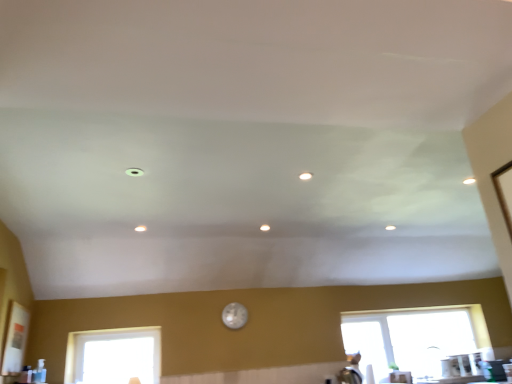
Identify the location of transparent glass window at lower right, which is the second window from front to back. The height and width of the screenshot is (384, 512). click(x=414, y=338).

Describe the element at coordinates (114, 356) in the screenshot. I see `transparent glass window at lower left, the second window in the right-to-left sequence` at that location.

I want to click on transparent glass window at lower right, the 2th window when ordered from left to right, so point(414,338).

Between transparent glass window at lower left, the second window in the right-to-left sequence, and transparent glass window at lower right, which is the second window from front to back, which one has smaller size?

transparent glass window at lower left, the second window in the right-to-left sequence, is smaller.

From a real-world perspective, is transparent glass window at lower left, the second window in the right-to-left sequence, located beneath transparent glass window at lower right, which is the second window from front to back?

Actually, transparent glass window at lower left, the second window in the right-to-left sequence, is physically above transparent glass window at lower right, which is the second window from front to back, in the real world.

At what (x,y) coordinates should I click in order to perform the action: click on window on the left of transparent glass window at lower right, the 2th window when ordered from left to right. Please return your answer as a coordinate pair (x, y). This screenshot has width=512, height=384. Looking at the image, I should click on (114, 356).

Is the position of transparent glass window at lower left, the second window in the right-to-left sequence, less distant than that of transparent glass window at lower right, the 2th window when ordered from left to right?

Yes, transparent glass window at lower left, the second window in the right-to-left sequence, is closer to the viewer.

Who is bigger, transparent glass window at lower left, which is the 2th window from back to front, or pearl-like glass clock at center?

transparent glass window at lower left, which is the 2th window from back to front, is bigger.

From the image's perspective, is transparent glass window at lower left, the second window in the right-to-left sequence, above or below pearl-like glass clock at center?

transparent glass window at lower left, the second window in the right-to-left sequence, is situated lower than pearl-like glass clock at center in the image.

This screenshot has width=512, height=384. What are the coordinates of `clock on the right of transparent glass window at lower left, the first window when ordered from front to back` in the screenshot? It's located at (234, 315).

From a real-world perspective, is transparent glass window at lower left, the second window in the right-to-left sequence, positioned above or below pearl-like glass clock at center?

From a real-world perspective, transparent glass window at lower left, the second window in the right-to-left sequence, is physically below pearl-like glass clock at center.

Considering the sizes of objects transparent glass window at lower right, the 2th window when ordered from left to right, and pearl-like glass clock at center in the image provided, who is bigger, transparent glass window at lower right, the 2th window when ordered from left to right, or pearl-like glass clock at center?

transparent glass window at lower right, the 2th window when ordered from left to right.

Considering the relative positions of transparent glass window at lower right, the 2th window when ordered from left to right, and pearl-like glass clock at center in the image provided, is transparent glass window at lower right, the 2th window when ordered from left to right, to the left or to the right of pearl-like glass clock at center?

transparent glass window at lower right, the 2th window when ordered from left to right, is positioned on pearl-like glass clock at center's right side.

Does point (454, 320) lie behind point (241, 305)?

Yes, it is behind point (241, 305).

Is pearl-like glass clock at center turned away from transparent glass window at lower right, the first window in the back-to-front sequence?

No, pearl-like glass clock at center is not facing away from transparent glass window at lower right, the first window in the back-to-front sequence.

Can you tell me how much pearl-like glass clock at center and transparent glass window at lower right, the 2th window when ordered from left to right, differ in facing direction?

They differ by 0.092 degrees in their facing directions.

The width and height of the screenshot is (512, 384). Find the location of `clock on the left of transparent glass window at lower right, the 2th window when ordered from left to right`. clock on the left of transparent glass window at lower right, the 2th window when ordered from left to right is located at coordinates (234, 315).

Is pearl-like glass clock at center at the left side of transparent glass window at lower right, positioned as the first window in right-to-left order?

Yes, pearl-like glass clock at center is to the left of transparent glass window at lower right, positioned as the first window in right-to-left order.

Looking at the image, does pearl-like glass clock at center seem bigger or smaller compared to transparent glass window at lower left, which is the 2th window from back to front?

Clearly, pearl-like glass clock at center is smaller in size than transparent glass window at lower left, which is the 2th window from back to front.

Is point (230, 310) closer or farther from the camera than point (91, 330)?

Point (230, 310) is farther from the camera than point (91, 330).

In the scene shown: Is pearl-like glass clock at center facing towards transparent glass window at lower left, which appears as the first window when viewed from the left?

No, pearl-like glass clock at center does not turn towards transparent glass window at lower left, which appears as the first window when viewed from the left.

You are a GUI agent. You are given a task and a screenshot of the screen. Output one action in this format:
    pyautogui.click(x=<x>, y=<y>)
    Task: Click on the window located on the right of transparent glass window at lower left, the first window when ordered from front to back
    
    Given the screenshot: What is the action you would take?
    pyautogui.click(x=414, y=338)

Would you say transparent glass window at lower right, the first window in the back-to-front sequence, is inside or outside transparent glass window at lower left, which is the 2th window from back to front?

transparent glass window at lower right, the first window in the back-to-front sequence, is not enclosed by transparent glass window at lower left, which is the 2th window from back to front.

From the image's perspective, which is below, transparent glass window at lower right, the 2th window when ordered from left to right, or transparent glass window at lower left, the first window when ordered from front to back?

transparent glass window at lower right, the 2th window when ordered from left to right, from the image's perspective.

In the image, is transparent glass window at lower right, the 2th window when ordered from left to right, on the left side or the right side of transparent glass window at lower left, the first window when ordered from front to back?

In the image, transparent glass window at lower right, the 2th window when ordered from left to right, appears on the right side of transparent glass window at lower left, the first window when ordered from front to back.

In order to click on window on the left side of transparent glass window at lower right, the first window in the back-to-front sequence in this screenshot , I will do `click(114, 356)`.

Locate an element on the screen. The width and height of the screenshot is (512, 384). clock above the transparent glass window at lower left, which is the 2th window from back to front (from the image's perspective) is located at coordinates (234, 315).

When comparing their distances from pearl-like glass clock at center, does transparent glass window at lower right, which is the second window from front to back, or transparent glass window at lower left, the second window in the right-to-left sequence, seem further?

transparent glass window at lower right, which is the second window from front to back, is further to pearl-like glass clock at center.

When comparing their distances from pearl-like glass clock at center, does transparent glass window at lower left, which is the 2th window from back to front, or transparent glass window at lower right, the 2th window when ordered from left to right, seem closer?

transparent glass window at lower left, which is the 2th window from back to front, lies closer to pearl-like glass clock at center than the other object.

Which object lies nearer to the anchor point transparent glass window at lower right, the 2th window when ordered from left to right, pearl-like glass clock at center or transparent glass window at lower left, which appears as the first window when viewed from the left?

The object closer to transparent glass window at lower right, the 2th window when ordered from left to right, is pearl-like glass clock at center.

Estimate the real-world distances between objects in this image. Which object is closer to transparent glass window at lower left, which appears as the first window when viewed from the left, pearl-like glass clock at center or transparent glass window at lower right, the first window in the back-to-front sequence?

pearl-like glass clock at center.

Looking at the image, which one is located closer to transparent glass window at lower left, the first window when ordered from front to back, transparent glass window at lower right, positioned as the first window in right-to-left order, or pearl-like glass clock at center?

Among the two, pearl-like glass clock at center is located nearer to transparent glass window at lower left, the first window when ordered from front to back.

Considering their positions, is transparent glass window at lower left, which appears as the first window when viewed from the left, positioned closer to transparent glass window at lower right, the 2th window when ordered from left to right, than pearl-like glass clock at center?

pearl-like glass clock at center.

Find the location of `clock between transparent glass window at lower left, the first window when ordered from front to back, and transparent glass window at lower right, positioned as the first window in right-to-left order`. clock between transparent glass window at lower left, the first window when ordered from front to back, and transparent glass window at lower right, positioned as the first window in right-to-left order is located at coordinates click(x=234, y=315).